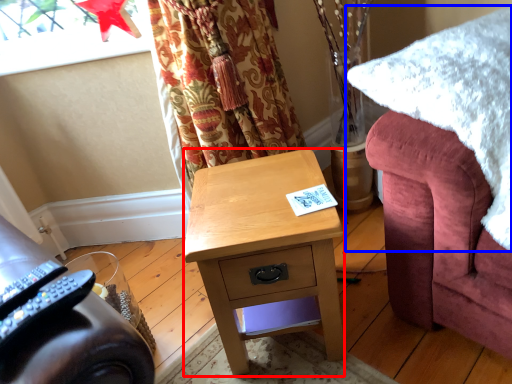
Question: Among these objects, which one is farthest to the camera, desk (highlighted by a red box) or blanket (highlighted by a blue box)?

Choices:
 (A) desk
 (B) blanket

Answer: (A)